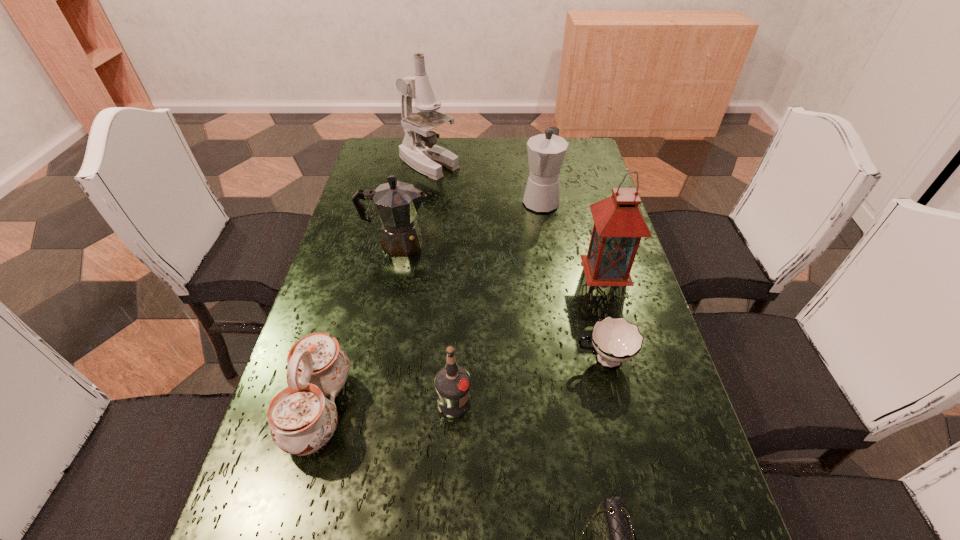
The image size is (960, 540). In order to click on coffeepot situated at the left edge in this screenshot , I will do `click(397, 203)`.

The height and width of the screenshot is (540, 960). What are the coordinates of `chinaware that is at the left edge` in the screenshot? It's located at tap(302, 420).

Identify the location of lantern that is at the right edge. (619, 225).

You are a GUI agent. You are given a task and a screenshot of the screen. Output one action in this format:
    pyautogui.click(x=<x>, y=<y>)
    Task: Click on the coffeepot that is at the right edge
    
    Given the screenshot: What is the action you would take?
    pyautogui.click(x=546, y=152)

Where is `cup present at the right edge`? The width and height of the screenshot is (960, 540). cup present at the right edge is located at coordinates 615,340.

This screenshot has width=960, height=540. I want to click on object that is at the far left corner, so click(418, 149).

The height and width of the screenshot is (540, 960). Identify the location of vacant space at the left edge of the desktop. (363, 257).

This screenshot has width=960, height=540. Identify the location of blank area at the right edge. (670, 394).

The height and width of the screenshot is (540, 960). Identify the location of vacant space that is in between the vodka and the cup. (529, 381).

I want to click on free spot between the farthest object and the vodka, so click(x=442, y=282).